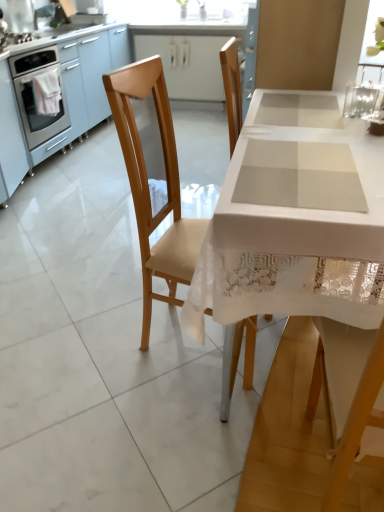
Where is `vacant area situated to the left side of wooden chair at left`? vacant area situated to the left side of wooden chair at left is located at coordinates (98, 337).